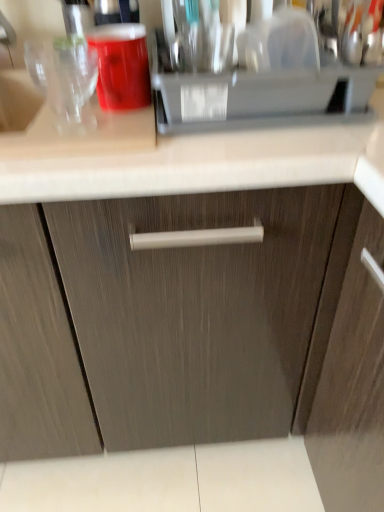
The width and height of the screenshot is (384, 512). In order to click on matte wood cabinet at center in this screenshot , I will do `click(205, 331)`.

Measure the distance between matte wood cabinet at center and camera.

matte wood cabinet at center is 24.17 inches from camera.

What do you see at coordinates (205, 331) in the screenshot? Image resolution: width=384 pixels, height=512 pixels. I see `matte wood cabinet at center` at bounding box center [205, 331].

You are a GUI agent. You are given a task and a screenshot of the screen. Output one action in this format:
    pyautogui.click(x=<x>, y=<y>)
    Task: Click on the matte wood cabinet at center
    This screenshot has height=512, width=384.
    Given the screenshot: What is the action you would take?
    pyautogui.click(x=205, y=331)